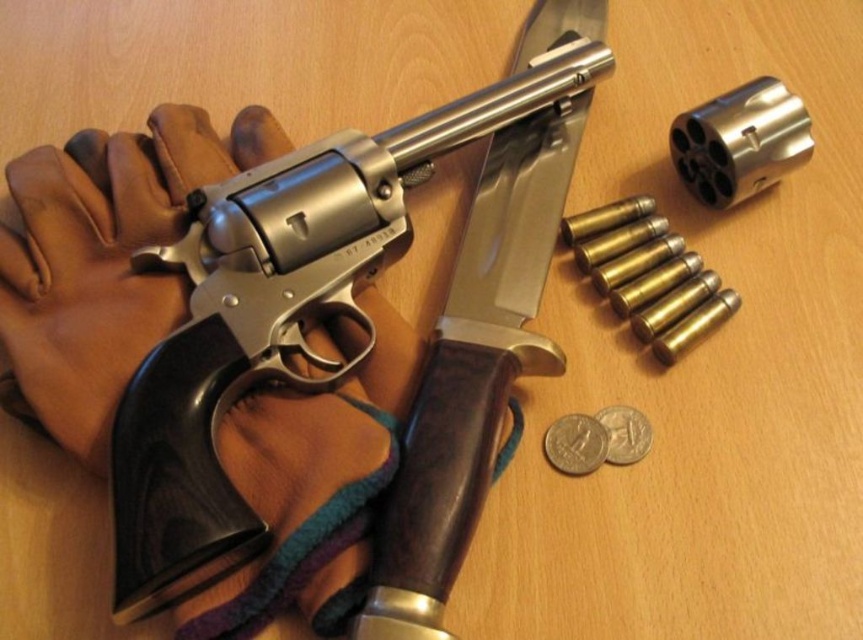
Which is behind, point (413, 140) or point (602, 460)?

The point (413, 140) is behind.

Does point (173, 432) lie in front of point (570, 458)?

Yes, it is.

Identify the location of polished metal revolver at center. The image size is (863, 640). (274, 317).

Does silver metallic coin at lower center have a larger size compared to silver metallic coin at lower right?

Yes.

Is silver metallic coin at lower center closer to camera compared to silver metallic coin at lower right?

No, it is not.

Where is `silver metallic coin at lower center`? The width and height of the screenshot is (863, 640). silver metallic coin at lower center is located at coordinates (575, 444).

Can you confirm if brown leather glove at left is positioned above silver metallic coin at lower center?

Correct, brown leather glove at left is located above silver metallic coin at lower center.

Is point (99, 164) closer to camera compared to point (565, 465)?

No.

Between point (70, 285) and point (602, 438), which one is positioned behind?

Positioned behind is point (602, 438).

The height and width of the screenshot is (640, 863). I want to click on brown leather glove at left, so click(105, 259).